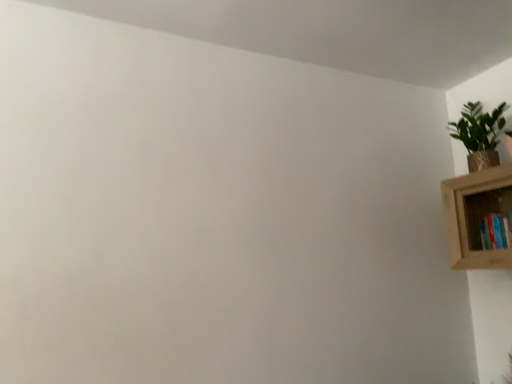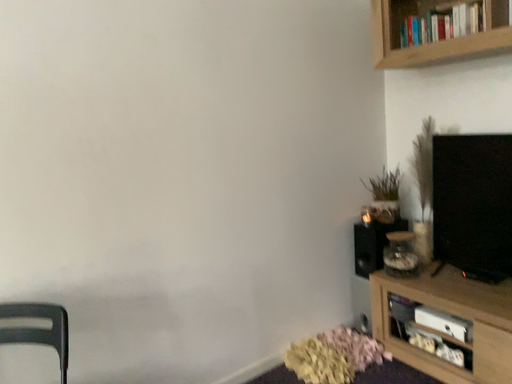
Question: How did the camera likely rotate when shooting the video?

Choices:
 (A) rotated downward
 (B) rotated upward

Answer: (A)